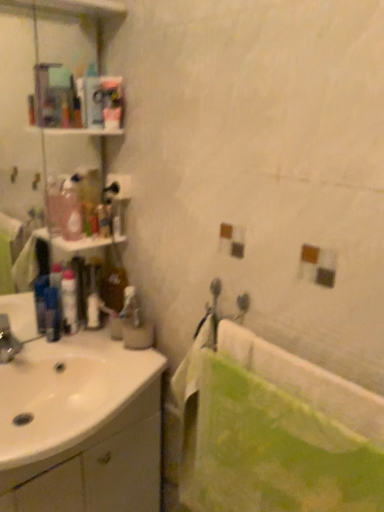
Where is `vacant space to the right of blue plastic mouthwash at left`? The height and width of the screenshot is (512, 384). vacant space to the right of blue plastic mouthwash at left is located at coordinates tap(82, 342).